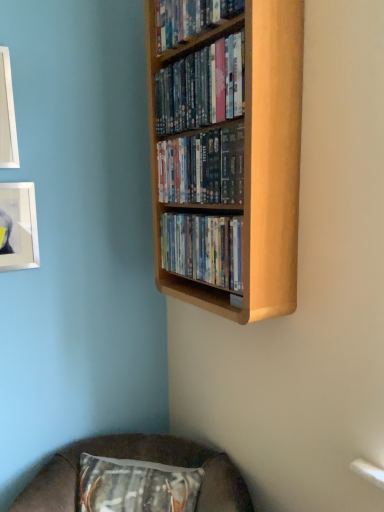
Where is `metallic silver picture frame at upper left, marked as the second picture frame in a top-to-bottom arrangement`? Image resolution: width=384 pixels, height=512 pixels. metallic silver picture frame at upper left, marked as the second picture frame in a top-to-bottom arrangement is located at coordinates (18, 227).

Describe the element at coordinates (253, 160) in the screenshot. I see `light wood bookcase at upper center` at that location.

I want to click on shiny plastic dvds at center, acting as the second book starting from the bottom, so click(202, 168).

What do you see at coordinates (203, 248) in the screenshot?
I see `matte plastic dvds at center, arranged as the 4th book when viewed from the top` at bounding box center [203, 248].

Describe the element at coordinates (201, 87) in the screenshot. I see `wooden shelf at upper center, which appears as the 2th book when viewed from the top` at that location.

The height and width of the screenshot is (512, 384). I want to click on metallic silver picture frame at upper left, marked as the second picture frame in a top-to-bottom arrangement, so click(18, 227).

From the image's perspective, is metallic silver picture frame at upper left, marked as the second picture frame in a top-to-bottom arrangement, above or below shiny plastic dvds at center, arranged as the 3th book when viewed from the top?

From the image's perspective, metallic silver picture frame at upper left, marked as the second picture frame in a top-to-bottom arrangement, appears below shiny plastic dvds at center, arranged as the 3th book when viewed from the top.

Which is in front, point (7, 238) or point (242, 187)?

Point (242, 187)

Is metallic silver picture frame at upper left, marked as the second picture frame in a top-to-bottom arrangement, oriented away from shiny plastic dvds at center, arranged as the 3th book when viewed from the top?

No, metallic silver picture frame at upper left, marked as the second picture frame in a top-to-bottom arrangement, is not facing away from shiny plastic dvds at center, arranged as the 3th book when viewed from the top.

Consider the image. How much distance is there between metallic silver picture frame at upper left, marked as the second picture frame in a top-to-bottom arrangement, and shiny plastic dvds at center, acting as the second book starting from the bottom?

57.00 centimeters.

Which of these two, brown fabric cushion at lower center or wooden shelf at upper center, which appears as the 2th book when viewed from the top, is wider?

Wider between the two is brown fabric cushion at lower center.

From the picture: Is brown fabric cushion at lower center positioned far away from wooden shelf at upper center, which appears as the 2th book when viewed from the top?

Indeed, brown fabric cushion at lower center is not near wooden shelf at upper center, which appears as the 2th book when viewed from the top.

Between brown fabric cushion at lower center and wooden shelf at upper center, which appears as the 2th book when viewed from the top, which one has smaller size?

With smaller size is wooden shelf at upper center, which appears as the 2th book when viewed from the top.

Which is behind, point (213, 449) or point (237, 273)?

The point (213, 449) is farther from the camera.

This screenshot has height=512, width=384. Find the location of `furniture lying below the matte plastic dvds at center, which ranks as the first book in bottom-to-top order (from the image's perspective)`. furniture lying below the matte plastic dvds at center, which ranks as the first book in bottom-to-top order (from the image's perspective) is located at coordinates (138, 459).

Does brown fabric cushion at lower center turn towards matte plastic dvds at center, which ranks as the first book in bottom-to-top order?

No, brown fabric cushion at lower center is not oriented towards matte plastic dvds at center, which ranks as the first book in bottom-to-top order.

From the image's perspective, is light wood bookcase at upper center above wooden shelf at upper center, the fourth book when ordered from bottom to top?

No, from the image's perspective, light wood bookcase at upper center is not on top of wooden shelf at upper center, the fourth book when ordered from bottom to top.

Is light wood bookcase at upper center wider than wooden shelf at upper center, which is the first book from top to bottom?

No, light wood bookcase at upper center is not wider than wooden shelf at upper center, which is the first book from top to bottom.

Are light wood bookcase at upper center and wooden shelf at upper center, the fourth book when ordered from bottom to top, located far from each other?

light wood bookcase at upper center is near wooden shelf at upper center, the fourth book when ordered from bottom to top, not far away.

Which is more distant, [288,188] or [198,7]?

The point [198,7] is more distant.

From the image's perspective, which one is positioned higher, white glossy picture frame at upper left, which is the first picture frame from top to bottom, or wooden shelf at upper center, the fourth book when ordered from bottom to top?

wooden shelf at upper center, the fourth book when ordered from bottom to top, appears higher in the image.

Which point is more distant from viewer, [0,54] or [229,13]?

The point [0,54] is more distant.

Is white glossy picture frame at upper left, which is the first picture frame from top to bottom, with wooden shelf at upper center, the fourth book when ordered from bottom to top?

No, white glossy picture frame at upper left, which is the first picture frame from top to bottom, is not making contact with wooden shelf at upper center, the fourth book when ordered from bottom to top.

Does white glossy picture frame at upper left, the second picture frame from the bottom, have a greater width compared to wooden shelf at upper center, which is the first book from top to bottom?

No, white glossy picture frame at upper left, the second picture frame from the bottom, is not wider than wooden shelf at upper center, which is the first book from top to bottom.

Which picture frame is the 2nd one when counting from the left side of the matte plastic dvds at center, which ranks as the first book in bottom-to-top order? Please provide its 2D coordinates.

[(7, 115)]

Can you confirm if white glossy picture frame at upper left, the second picture frame from the bottom, is bigger than matte plastic dvds at center, arranged as the 4th book when viewed from the top?

No, white glossy picture frame at upper left, the second picture frame from the bottom, is not bigger than matte plastic dvds at center, arranged as the 4th book when viewed from the top.

From a real-world perspective, is white glossy picture frame at upper left, which is the first picture frame from top to bottom, located higher than matte plastic dvds at center, arranged as the 4th book when viewed from the top?

Indeed, from a real-world perspective, white glossy picture frame at upper left, which is the first picture frame from top to bottom, stands above matte plastic dvds at center, arranged as the 4th book when viewed from the top.

Is point (168, 267) positioned behind point (83, 445)?

No, it is not.

Between matte plastic dvds at center, which ranks as the first book in bottom-to-top order, and brown fabric cushion at lower center, which one has larger size?

With larger size is brown fabric cushion at lower center.

The height and width of the screenshot is (512, 384). I want to click on furniture below the matte plastic dvds at center, which ranks as the first book in bottom-to-top order (from the image's perspective), so click(138, 459).

Is matte plastic dvds at center, arranged as the 4th book when viewed from the top, wider than brown fabric cushion at lower center?

Incorrect, the width of matte plastic dvds at center, arranged as the 4th book when viewed from the top, does not surpass that of brown fabric cushion at lower center.

This screenshot has height=512, width=384. What are the coordinates of `the 2nd picture frame behind the shiny plastic dvds at center, arranged as the 3th book when viewed from the top, starting your count from the anchor` in the screenshot? It's located at (18, 227).

Image resolution: width=384 pixels, height=512 pixels. In order to click on the 3rd book above the brown fabric cushion at lower center (from a real-world perspective) in this screenshot , I will do `click(201, 87)`.

When comparing their distances from metallic silver picture frame at upper left, marked as the second picture frame in a top-to-bottom arrangement, does brown fabric cushion at lower center or wooden shelf at upper center, the 3th book from the bottom, seem closer?

Based on the image, wooden shelf at upper center, the 3th book from the bottom, appears to be nearer to metallic silver picture frame at upper left, marked as the second picture frame in a top-to-bottom arrangement.

Estimate the real-world distances between objects in this image. Which object is further from wooden shelf at upper center, which appears as the 2th book when viewed from the top, white glossy picture frame at upper left, which is the first picture frame from top to bottom, or metallic silver picture frame at upper left, the first picture frame in the bottom-to-top sequence?

metallic silver picture frame at upper left, the first picture frame in the bottom-to-top sequence, is positioned further to the anchor wooden shelf at upper center, which appears as the 2th book when viewed from the top.

Looking at the image, which one is located further to metallic silver picture frame at upper left, the first picture frame in the bottom-to-top sequence, white glossy picture frame at upper left, the second picture frame from the bottom, or wooden shelf at upper center, the 3th book from the bottom?

wooden shelf at upper center, the 3th book from the bottom, is further to metallic silver picture frame at upper left, the first picture frame in the bottom-to-top sequence.

Looking at the image, which one is located closer to metallic silver picture frame at upper left, marked as the second picture frame in a top-to-bottom arrangement, shiny plastic dvds at center, acting as the second book starting from the bottom, or matte plastic dvds at center, which ranks as the first book in bottom-to-top order?

matte plastic dvds at center, which ranks as the first book in bottom-to-top order, lies closer to metallic silver picture frame at upper left, marked as the second picture frame in a top-to-bottom arrangement, than the other object.

From the picture: Considering their positions, is wooden shelf at upper center, which appears as the 2th book when viewed from the top, positioned further to matte plastic dvds at center, arranged as the 4th book when viewed from the top, than shiny plastic dvds at center, arranged as the 3th book when viewed from the top?

wooden shelf at upper center, which appears as the 2th book when viewed from the top, lies further to matte plastic dvds at center, arranged as the 4th book when viewed from the top, than the other object.

Looking at this image, considering their positions, is wooden shelf at upper center, the 3th book from the bottom, positioned closer to light wood bookcase at upper center than shiny plastic dvds at center, acting as the second book starting from the bottom?

Among the two, wooden shelf at upper center, the 3th book from the bottom, is located nearer to light wood bookcase at upper center.

Considering their positions, is brown fabric cushion at lower center positioned further to wooden shelf at upper center, the 3th book from the bottom, than metallic silver picture frame at upper left, the first picture frame in the bottom-to-top sequence?

brown fabric cushion at lower center is further to wooden shelf at upper center, the 3th book from the bottom.

Considering their positions, is wooden shelf at upper center, which appears as the 2th book when viewed from the top, positioned closer to wooden shelf at upper center, the fourth book when ordered from bottom to top, than white glossy picture frame at upper left, which is the first picture frame from top to bottom?

Based on the image, wooden shelf at upper center, which appears as the 2th book when viewed from the top, appears to be nearer to wooden shelf at upper center, the fourth book when ordered from bottom to top.

You are a GUI agent. You are given a task and a screenshot of the screen. Output one action in this format:
    pyautogui.click(x=<x>, y=<y>)
    Task: Click on the bookcase located between metallic silver picture frame at upper left, marked as the second picture frame in a top-to-bottom arrangement, and wooden shelf at upper center, which appears as the 2th book when viewed from the top, in the left-right direction
    This screenshot has width=384, height=512.
    Given the screenshot: What is the action you would take?
    pyautogui.click(x=253, y=160)

You are a GUI agent. You are given a task and a screenshot of the screen. Output one action in this format:
    pyautogui.click(x=<x>, y=<y>)
    Task: Click on the bookcase between wooden shelf at upper center, the 3th book from the bottom, and shiny plastic dvds at center, acting as the second book starting from the bottom, from top to bottom
    
    Given the screenshot: What is the action you would take?
    pyautogui.click(x=253, y=160)

Where is `bookcase between wooden shelf at upper center, the fourth book when ordered from bottom to top, and shiny plastic dvds at center, arranged as the 3th book when viewed from the top, vertically`? bookcase between wooden shelf at upper center, the fourth book when ordered from bottom to top, and shiny plastic dvds at center, arranged as the 3th book when viewed from the top, vertically is located at coordinates (253, 160).

Identify the location of book that lies between wooden shelf at upper center, which is the first book from top to bottom, and shiny plastic dvds at center, acting as the second book starting from the bottom, from top to bottom. Image resolution: width=384 pixels, height=512 pixels. (201, 87).